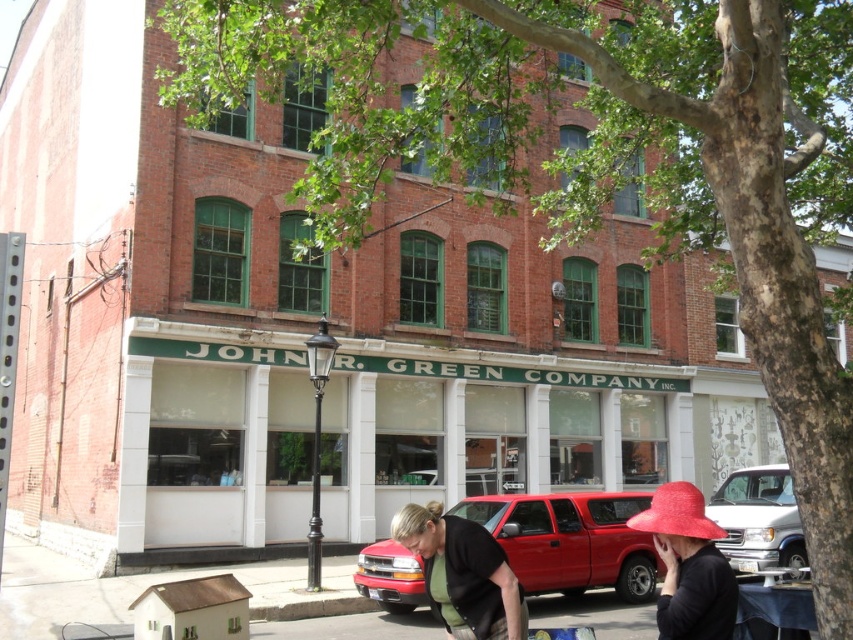
Question: Is black matte street vendor at lower center thinner than matte red hat at lower right?

Choices:
 (A) no
 (B) yes

Answer: (A)

Question: Considering the relative positions of matte red hat at lower right and silver metallic van at center in the image provided, where is matte red hat at lower right located with respect to silver metallic van at center?

Choices:
 (A) left
 (B) right

Answer: (A)

Question: Can you confirm if metallic red truck at center is bigger than black matte street vendor at lower center?

Choices:
 (A) yes
 (B) no

Answer: (A)

Question: Which of the following is the closest to the observer?

Choices:
 (A) (579, 545)
 (B) (447, 605)
 (C) (724, 576)
 (D) (743, 524)

Answer: (C)

Question: Which of the following is the closest to the observer?

Choices:
 (A) (628, 518)
 (B) (457, 556)

Answer: (B)

Question: Considering the real-world distances, which object is closest to the black matte street vendor at lower center?

Choices:
 (A) metallic red truck at center
 (B) silver metallic van at center
 (C) matte red hat at lower right

Answer: (C)